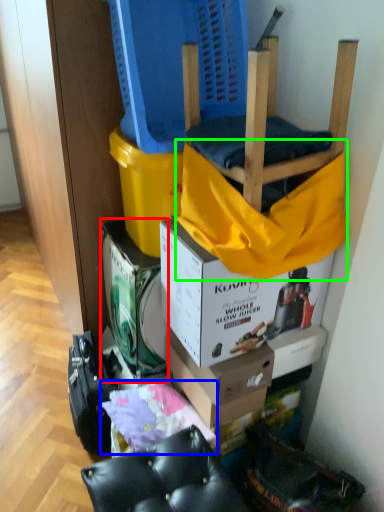
Question: Considering the real-world distances, which object is farthest from box (highlighted by a red box)? material (highlighted by a blue box) or blanket (highlighted by a green box)?

Choices:
 (A) material
 (B) blanket

Answer: (B)